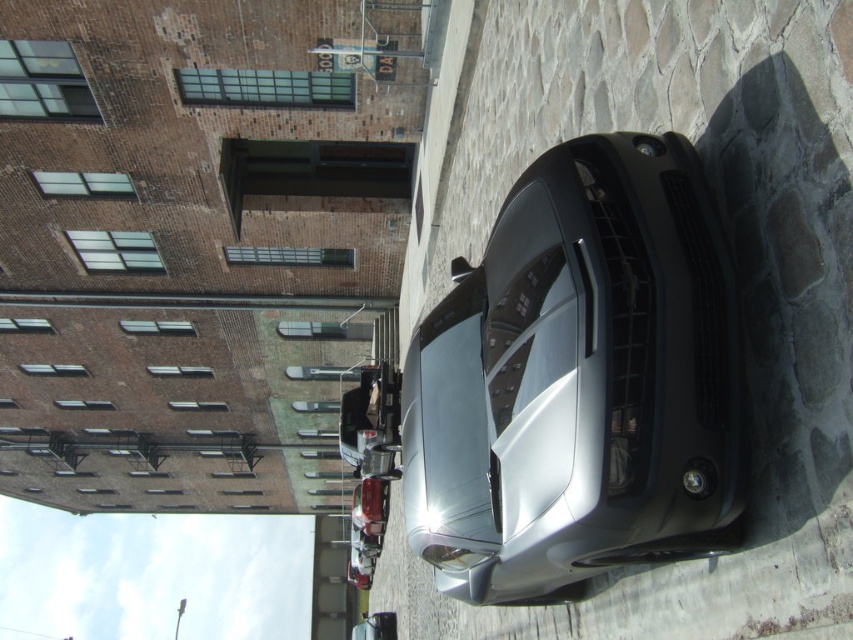
You are a photographer wanting to capture both the satin silver car at center and the shiny metallic car at center in a single frame. Given their heights, which car will appear smaller in the photo?

The satin silver car at center will appear smaller in the photo because it is not as tall as the shiny metallic car at center.

You are standing on the cobblestone road in the urban street scene. There is a point marked at coordinates (578, 380). What object is located at that point?

The point at coordinates (578, 380) is occupied by the satin silver car at center.

You are a pedestrian standing on the cobblestone road and want to cross to the other side. There are two cars at the center, a satin silver car at center and a shiny metallic car at center. Which car is closer to you?

The satin silver car at center is in front of the shiny metallic car at center, so the satin silver car at center is closer to you.